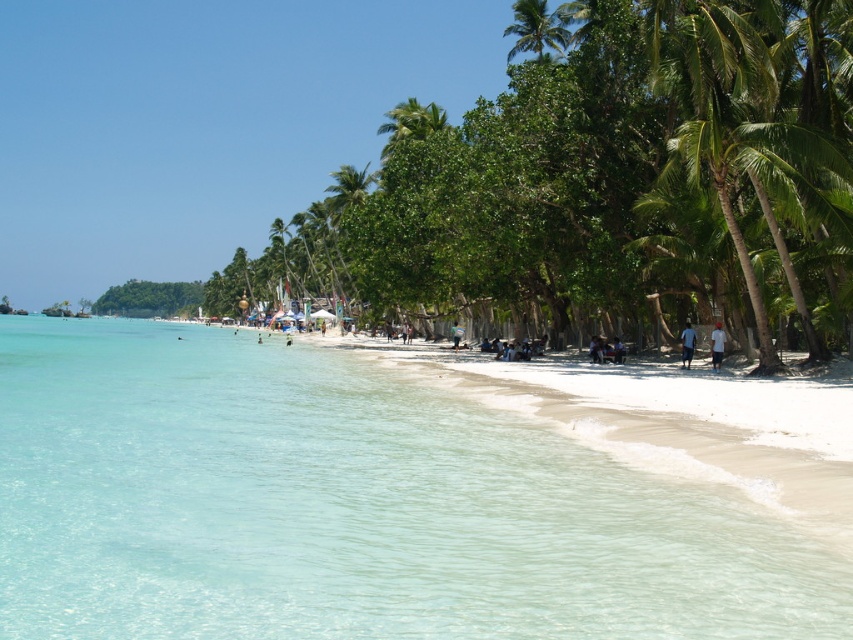
You are standing on the beach and see both the white matte shirt at lower right and the blue fabric shirt at lower right. Which shirt is nearer to you?

The white matte shirt at lower right is closer to the viewer than the blue fabric shirt at lower right, so the white matte shirt is nearer to you.

You are a photographer standing on the beach and want to take a picture of the white matte shirt at lower right without the green leafy palm tree at upper right blocking the view. Is this possible?

The green leafy palm tree at upper right is located above the white matte shirt at lower right, so it will block the view of the white matte shirt at lower right. You cannot take a clear picture without the tree in the frame.